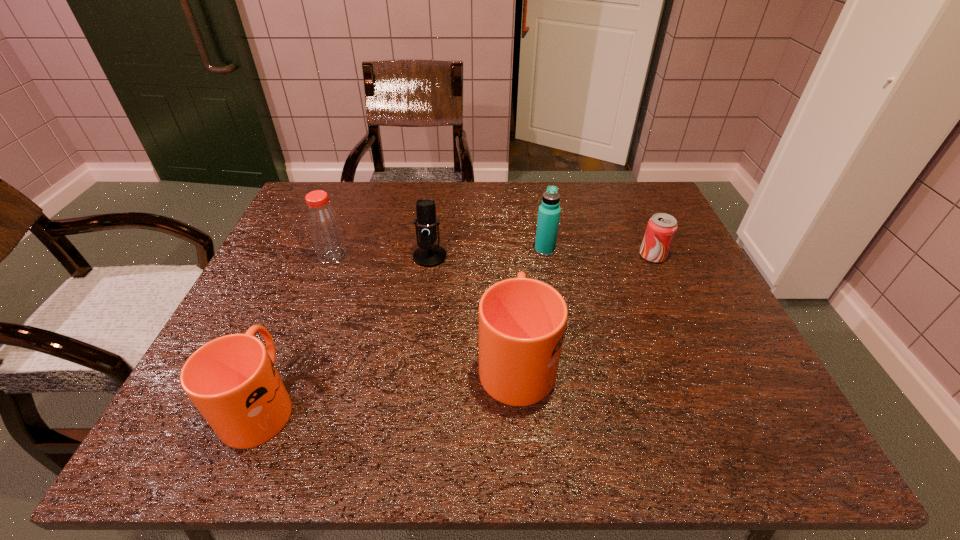
Identify the location of the left mug. (232, 380).

This screenshot has width=960, height=540. I want to click on the taller mug, so click(x=522, y=321).

You are a GUI agent. You are given a task and a screenshot of the screen. Output one action in this format:
    pyautogui.click(x=<x>, y=<y>)
    Task: Click on the soda can
    This screenshot has width=960, height=540.
    Given the screenshot: What is the action you would take?
    (x=661, y=228)

Find the location of a particular element. Image resolution: width=960 pixels, height=540 pixels. the shortest object is located at coordinates coord(661,228).

The width and height of the screenshot is (960, 540). Find the location of `bottle`. bottle is located at coordinates (324, 226).

Where is `water bottle`? This screenshot has height=540, width=960. water bottle is located at coordinates (549, 211).

Find the location of a particular element. the third object from left to right is located at coordinates (427, 255).

Locate an element on the screen. The image size is (960, 540). vacant area situated 0.390m on the handle side of the shorter mug is located at coordinates (326, 246).

Image resolution: width=960 pixels, height=540 pixels. Identify the location of free space located 0.270m on the handle side of the shorter mug. [x=315, y=275].

Locate an element on the screen. free space located 0.200m on the handle side of the shorter mug is located at coordinates (306, 295).